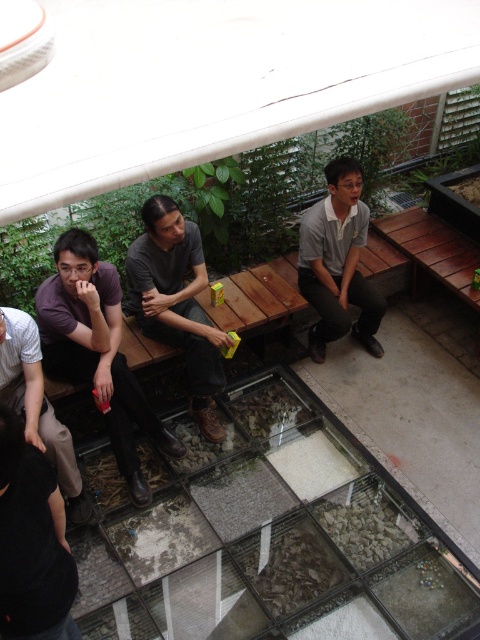
Where is the purple matte shirt at left located in the image?

The purple matte shirt at left is located at point (96, 349).

You are a photographer standing at the edge of the glass floor display. You need to capture a photo of both the matte gray shirt at center and the gray matte shirt at center in the same frame. Given that your camera has a minimum focus distance of 1 meter, will you be able to focus on both subjects simultaneously?

The matte gray shirt at center and gray matte shirt at center are 1.08 meters apart. Since the distance between them is slightly more than 1 meter, the camera can focus on both subjects as the separation meets the minimum focus distance requirement.